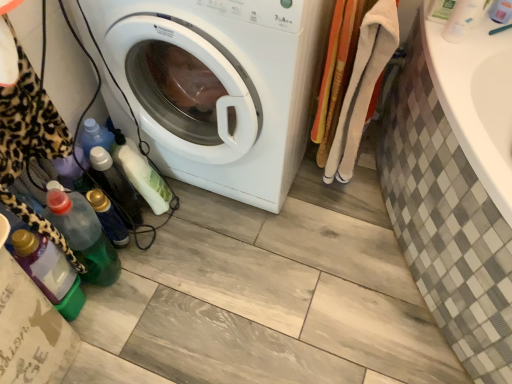
You are a GUI agent. You are given a task and a screenshot of the screen. Output one action in this format:
    pyautogui.click(x=<x>, y=<y>)
    Task: Click on the translucent plastic bottle at lower left, the 6th bottle viewed from the right
    This screenshot has height=384, width=512.
    Given the screenshot: What is the action you would take?
    pyautogui.click(x=84, y=236)

How much space does green matte bottle at upper right, which appears as the second bottle when viewed from the right, occupy horizontally?

3.40 inches.

Where is `white plastic bottle at upper right`? The image size is (512, 384). white plastic bottle at upper right is located at coordinates (501, 11).

At what (x,y) coordinates should I click in order to perform the action: click on translucent plastic bottle at lower left, the second bottle when ordered from left to right. Please return your answer as a coordinate pair (x, y). Looking at the image, I should click on (84, 236).

Is translucent plastic bottle at lower left, the fifth bottle when ordered from right to left, located within translucent plastic bottle at lower left, the second bottle when ordered from left to right?

No, translucent plastic bottle at lower left, the fifth bottle when ordered from right to left, is not inside translucent plastic bottle at lower left, the second bottle when ordered from left to right.

Does translucent plastic bottle at lower left, the 6th bottle viewed from the right, have a larger size compared to translucent plastic bottle at lower left, acting as the third bottle starting from the left?

Yes.

Is translucent plastic bottle at lower left, the 6th bottle viewed from the right, oriented towards translucent plastic bottle at lower left, the fifth bottle when ordered from right to left?

Yes.

Which is more to the left, translucent plastic bottle at lower left, the 6th bottle viewed from the right, or translucent plastic bottle at lower left, the fifth bottle when ordered from right to left?

From the viewer's perspective, translucent plastic bottle at lower left, the 6th bottle viewed from the right, appears more on the left side.

How different are the orientations of translucent plastic bottle at lower left, the fourth bottle from the right, and translucent plastic bottle at lower left, acting as the third bottle starting from the left, in degrees?

1.18 degrees separate the facing orientations of translucent plastic bottle at lower left, the fourth bottle from the right, and translucent plastic bottle at lower left, acting as the third bottle starting from the left.

Considering the positions of objects translucent plastic bottle at lower left, which is counted as the fourth bottle, starting from the left, and translucent plastic bottle at lower left, the fifth bottle when ordered from right to left, in the image provided, who is more to the left, translucent plastic bottle at lower left, which is counted as the fourth bottle, starting from the left, or translucent plastic bottle at lower left, the fifth bottle when ordered from right to left,?

translucent plastic bottle at lower left, the fifth bottle when ordered from right to left, is more to the left.

From the image's perspective, which object appears higher, translucent plastic bottle at lower left, which is counted as the fourth bottle, starting from the left, or translucent plastic bottle at lower left, the fifth bottle when ordered from right to left?

translucent plastic bottle at lower left, which is counted as the fourth bottle, starting from the left, appears higher in the image.

From a real-world perspective, does soft cotton towels at right sit lower than white matte bottle at upper right, acting as the 7th bottle starting from the left?

Yes.

Where is `bottle that is the 1st object located above the soft cotton towels at right (from the image's perspective)`? Image resolution: width=512 pixels, height=384 pixels. bottle that is the 1st object located above the soft cotton towels at right (from the image's perspective) is located at coordinates (463, 19).

From the image's perspective, is soft cotton towels at right above white matte bottle at upper right, which ranks as the first bottle in right-to-left order?

No.

Is white plastic bottle at upper right completely or partially inside soft cotton towels at right?

No, white plastic bottle at upper right is located outside of soft cotton towels at right.

Is soft cotton towels at right taller or shorter than white plastic bottle at upper right?

soft cotton towels at right is taller than white plastic bottle at upper right.

Can you confirm if soft cotton towels at right is smaller than white plastic bottle at upper right?

No, soft cotton towels at right is not smaller than white plastic bottle at upper right.

From the image's perspective, is white plastic bottle at upper right positioned above or below translucent plastic bottle at lower left, the 6th bottle viewed from the right?

Clearly, from the image's perspective, white plastic bottle at upper right is above translucent plastic bottle at lower left, the 6th bottle viewed from the right.

Is white plastic bottle at upper right taller or shorter than translucent plastic bottle at lower left, the second bottle when ordered from left to right?

Clearly, white plastic bottle at upper right is shorter compared to translucent plastic bottle at lower left, the second bottle when ordered from left to right.

Measure the distance between white plastic bottle at upper right and translucent plastic bottle at lower left, the 6th bottle viewed from the right.

4.24 feet.

Are white plastic bottle at upper right and translucent plastic bottle at lower left, the second bottle when ordered from left to right, located far from each other?

Indeed, white plastic bottle at upper right is not near translucent plastic bottle at lower left, the second bottle when ordered from left to right.

Consider the image. Between white matte bottle at upper right, which ranks as the first bottle in right-to-left order, and translucent plastic bottle at lower left, acting as the third bottle starting from the left, which one appears on the left side from the viewer's perspective?

translucent plastic bottle at lower left, acting as the third bottle starting from the left.

In the scene shown: Would you say translucent plastic bottle at lower left, the fifth bottle when ordered from right to left, is part of white matte bottle at upper right, which ranks as the first bottle in right-to-left order,'s contents?

No, translucent plastic bottle at lower left, the fifth bottle when ordered from right to left, is not surrounded by white matte bottle at upper right, which ranks as the first bottle in right-to-left order.

From their relative heights in the image, would you say white matte bottle at upper right, acting as the 7th bottle starting from the left, is taller or shorter than translucent plastic bottle at lower left, acting as the third bottle starting from the left?

white matte bottle at upper right, acting as the 7th bottle starting from the left, is shorter than translucent plastic bottle at lower left, acting as the third bottle starting from the left.

Does translucent plastic bottle at lower left, the 6th bottle viewed from the right, appear on the right side of translucent plastic bottle at lower left, the third bottle in the right-to-left sequence?

No.

Between translucent plastic bottle at lower left, the second bottle when ordered from left to right, and translucent plastic bottle at lower left, the third bottle in the right-to-left sequence, which one has larger width?

translucent plastic bottle at lower left, the third bottle in the right-to-left sequence.

Is translucent plastic bottle at lower left, the second bottle when ordered from left to right, outside of translucent plastic bottle at lower left, the third bottle in the right-to-left sequence?

translucent plastic bottle at lower left, the second bottle when ordered from left to right, is positioned outside translucent plastic bottle at lower left, the third bottle in the right-to-left sequence.

This screenshot has width=512, height=384. Identify the location of the 3rd bottle below when counting from the translucent plastic bottle at lower left, which ranks as the fifth bottle in left-to-right order (from the image's perspective). (84, 236).

Find the location of `the 1st bottle to the left of the translucent plastic bottle at lower left, acting as the third bottle starting from the left, starting your count from the anchor`. the 1st bottle to the left of the translucent plastic bottle at lower left, acting as the third bottle starting from the left, starting your count from the anchor is located at coordinates (84, 236).

From the image's perspective, which bottle is the 1st one above the translucent plastic bottle at lower left, the fifth bottle when ordered from right to left? Please provide its 2D coordinates.

[(115, 186)]

Considering their positions, is translucent plastic bottle at lower left, which ranks as the fifth bottle in left-to-right order, positioned further to soft cotton towels at right than translucent plastic bottle at lower left, the fourth bottle from the right?

translucent plastic bottle at lower left, the fourth bottle from the right, is further to soft cotton towels at right.

Looking at the image, which one is located closer to translucent plastic bottle at lower left, the 7th bottle positioned from the right, translucent plastic bottle at lower left, acting as the third bottle starting from the left, or translucent plastic bottle at lower left, which ranks as the fifth bottle in left-to-right order?

Based on the image, translucent plastic bottle at lower left, acting as the third bottle starting from the left, appears to be nearer to translucent plastic bottle at lower left, the 7th bottle positioned from the right.

Considering their positions, is translucent plastic bottle at lower left, the second bottle when ordered from left to right, positioned closer to translucent plastic bottle at lower left, the fourth bottle from the right, than soft cotton towels at right?

The object closer to translucent plastic bottle at lower left, the fourth bottle from the right, is translucent plastic bottle at lower left, the second bottle when ordered from left to right.

Estimate the real-world distances between objects in this image. Which object is further from white matte bottle at upper right, acting as the 7th bottle starting from the left, translucent plastic bottle at lower left, acting as the third bottle starting from the left, or white plastic bottle at upper right?

Based on the image, translucent plastic bottle at lower left, acting as the third bottle starting from the left, appears to be further to white matte bottle at upper right, acting as the 7th bottle starting from the left.

Consider the image. When comparing their distances from white glossy washing machine at center, does white matte bottle at upper right, acting as the 7th bottle starting from the left, or translucent plastic bottle at lower left, the second bottle when ordered from left to right, seem closer?

translucent plastic bottle at lower left, the second bottle when ordered from left to right, is positioned closer to the anchor white glossy washing machine at center.

Considering their positions, is translucent plastic bottle at lower left, the 1th bottle from the left, positioned further to white glossy washing machine at center than translucent plastic bottle at lower left, the fifth bottle when ordered from right to left?

translucent plastic bottle at lower left, the 1th bottle from the left.

Estimate the real-world distances between objects in this image. Which object is further from green matte bottle at upper right, the 6th bottle viewed from the left, translucent plastic bottle at lower left, the fifth bottle when ordered from right to left, or soft cotton towels at right?

Based on the image, translucent plastic bottle at lower left, the fifth bottle when ordered from right to left, appears to be further to green matte bottle at upper right, the 6th bottle viewed from the left.

From the image, which object appears to be nearer to translucent plastic bottle at lower left, the 6th bottle viewed from the right, soft cotton towels at right or translucent plastic bottle at lower left, the 7th bottle positioned from the right?

Based on the image, translucent plastic bottle at lower left, the 7th bottle positioned from the right, appears to be nearer to translucent plastic bottle at lower left, the 6th bottle viewed from the right.

Locate an element on the screen. The height and width of the screenshot is (384, 512). washing machine between translucent plastic bottle at lower left, the third bottle in the right-to-left sequence, and green matte bottle at upper right, which appears as the second bottle when viewed from the right is located at coordinates (223, 86).

You are a GUI agent. You are given a task and a screenshot of the screen. Output one action in this format:
    pyautogui.click(x=<x>, y=<y>)
    Task: Click on the washing machine between translucent plastic bottle at lower left, which is counted as the fourth bottle, starting from the left, and white plastic bottle at upper right, in the horizontal direction
    
    Given the screenshot: What is the action you would take?
    pyautogui.click(x=223, y=86)

Identify the location of bottle between translucent plastic bottle at lower left, which ranks as the fifth bottle in left-to-right order, and white matte bottle at upper right, acting as the 7th bottle starting from the left. The image size is (512, 384). (440, 10).

The height and width of the screenshot is (384, 512). I want to click on washing machine between translucent plastic bottle at lower left, the third bottle in the right-to-left sequence, and white matte bottle at upper right, acting as the 7th bottle starting from the left, from left to right, so click(x=223, y=86).